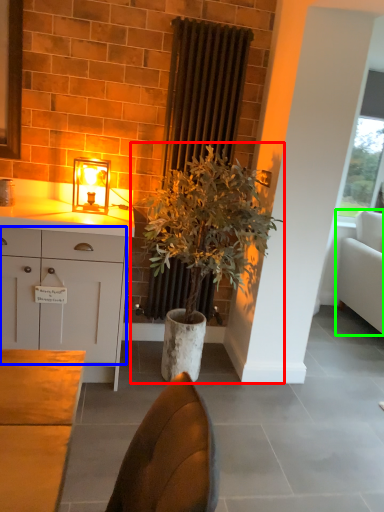
Question: Which object is the closest to the houseplant (highlighted by a red box)? Choose among these: cabinetry (highlighted by a blue box) or studio couch (highlighted by a green box).

Choices:
 (A) cabinetry
 (B) studio couch

Answer: (A)